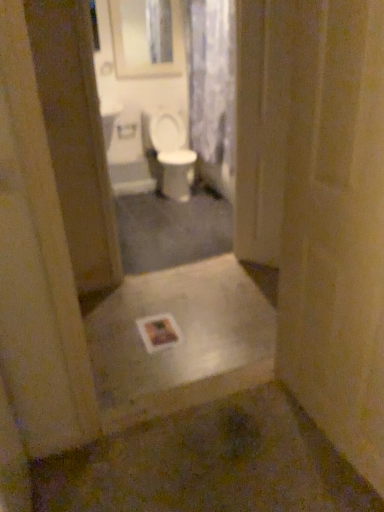
The image size is (384, 512). Find the location of `vacant space situated above metallic silver step at center (from a real-world perspective)`. vacant space situated above metallic silver step at center (from a real-world perspective) is located at coordinates (182, 350).